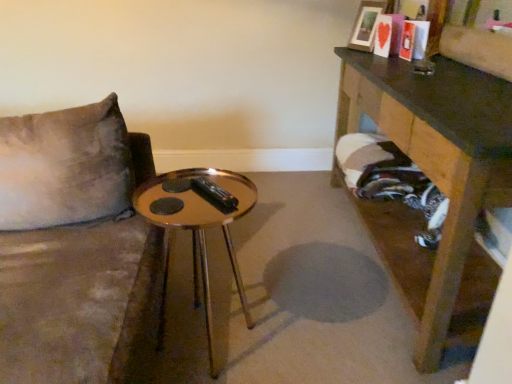
Question: From a real-world perspective, is wooden table at right, which is the 1th table from right to left, on gold reflective table at center, which appears as the 2th table when viewed from the right?

Choices:
 (A) no
 (B) yes

Answer: (B)

Question: Are wooden table at right, which is the 1th table from right to left, and gold reflective table at center, placed as the first table when sorted from left to right, located far from each other?

Choices:
 (A) yes
 (B) no

Answer: (B)

Question: Is wooden table at right, the 2th table from the left, further to the viewer compared to gold reflective table at center, which appears as the 2th table when viewed from the right?

Choices:
 (A) no
 (B) yes

Answer: (A)

Question: Considering the relative sizes of wooden table at right, the 2th table from the left, and gold reflective table at center, placed as the first table when sorted from left to right, in the image provided, is wooden table at right, the 2th table from the left, bigger than gold reflective table at center, placed as the first table when sorted from left to right,?

Choices:
 (A) no
 (B) yes

Answer: (B)

Question: Is wooden table at right, the 2th table from the left, taller than gold reflective table at center, placed as the first table when sorted from left to right?

Choices:
 (A) no
 (B) yes

Answer: (B)

Question: Is wooden table at right, which is the 1th table from right to left, shorter than gold reflective table at center, placed as the first table when sorted from left to right?

Choices:
 (A) no
 (B) yes

Answer: (A)

Question: Does wooden table at right, which is the 1th table from right to left, lie behind wooden picture frame at upper right?

Choices:
 (A) no
 (B) yes

Answer: (A)

Question: From the image's perspective, would you say wooden table at right, the 2th table from the left, is shown under wooden picture frame at upper right?

Choices:
 (A) no
 (B) yes

Answer: (B)

Question: Can you confirm if wooden table at right, which is the 1th table from right to left, is shorter than wooden picture frame at upper right?

Choices:
 (A) yes
 (B) no

Answer: (B)

Question: Is wooden table at right, which is the 1th table from right to left, to the right of wooden picture frame at upper right from the viewer's perspective?

Choices:
 (A) yes
 (B) no

Answer: (A)

Question: Considering the relative sizes of wooden table at right, which is the 1th table from right to left, and wooden picture frame at upper right in the image provided, is wooden table at right, which is the 1th table from right to left, smaller than wooden picture frame at upper right?

Choices:
 (A) no
 (B) yes

Answer: (A)

Question: Can you confirm if wooden table at right, which is the 1th table from right to left, is wider than wooden picture frame at upper right?

Choices:
 (A) no
 (B) yes

Answer: (B)

Question: Is gold reflective table at center, placed as the first table when sorted from left to right, looking in the opposite direction of wooden picture frame at upper right?

Choices:
 (A) no
 (B) yes

Answer: (A)